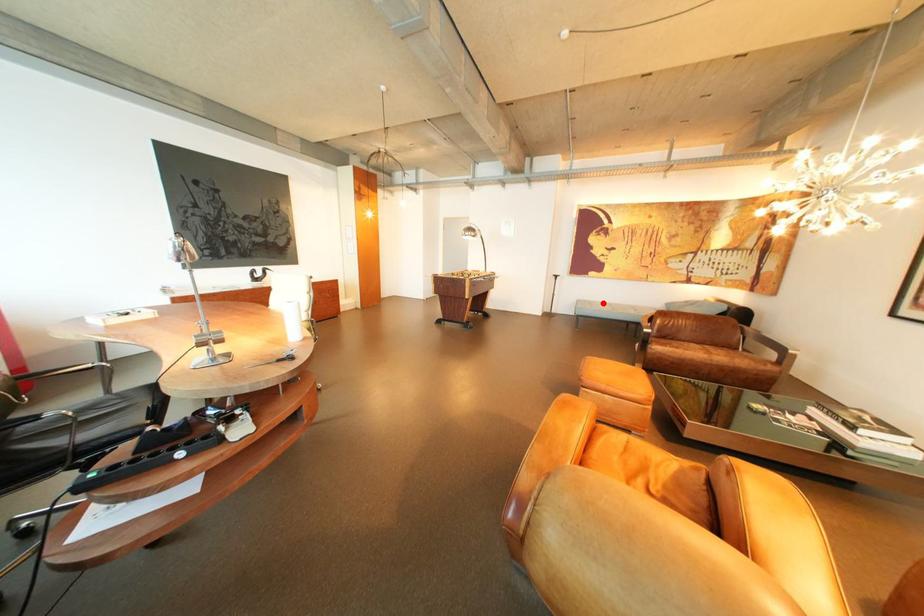
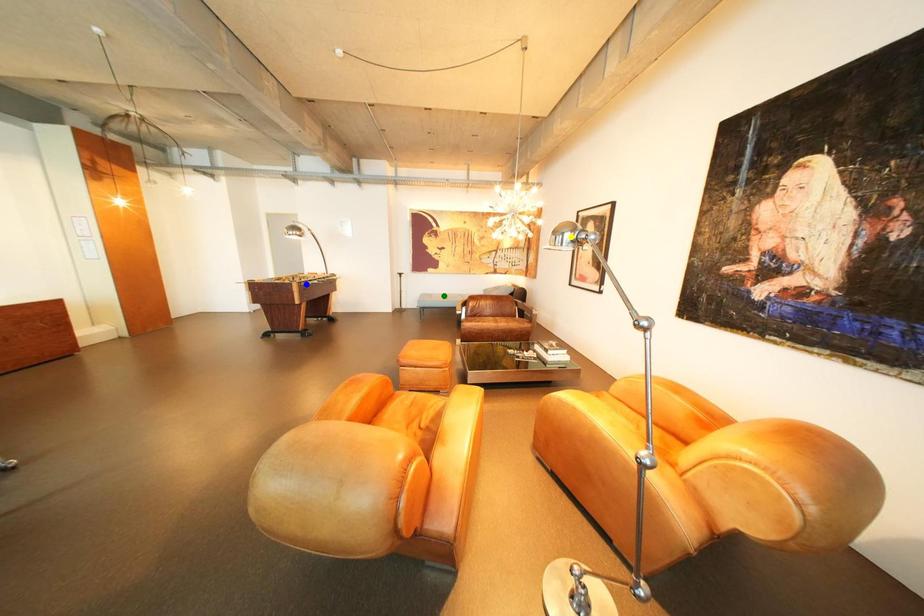
Question: I am providing you with two images of the same scene from different viewpoints. A red point is marked on the first image. You are given multiple points on the second image. Which point in image 2 is actually the same real-world point as the red point in image 1?

Choices:
 (A) green point
 (B) blue point
 (C) yellow point

Answer: (A)